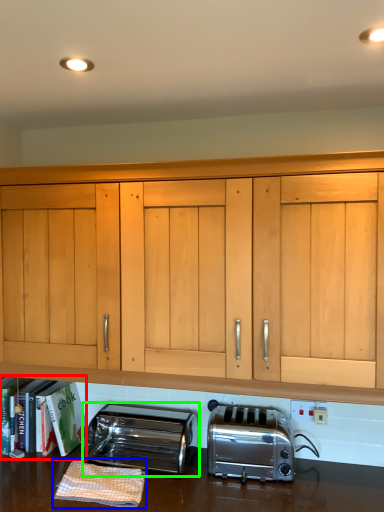
Question: Based on their relative distances, which object is farther from bookshelf (highlighted by a red box)? Choose from material (highlighted by a blue box) and toaster (highlighted by a green box).

Choices:
 (A) material
 (B) toaster

Answer: (A)